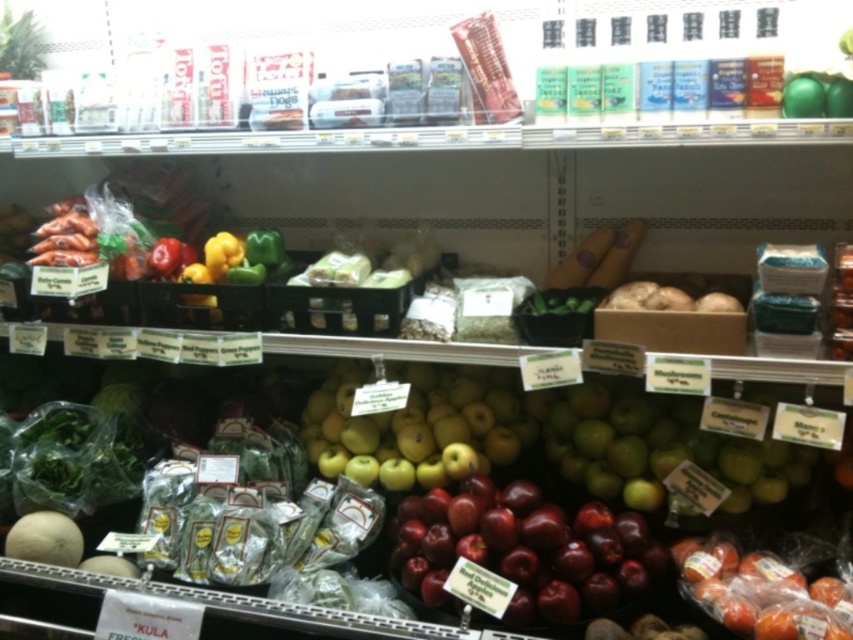
You are a customer in the grocery store looking at the apples on the second shelf. There are yellow matte apples at center and green matte apples at center. Which one is positioned to the left?

The yellow matte apples at center are positioned to the left of the green matte apples at center.

In the scene shown: You are a grocery store employee who needs to restock apples. You have a ladder that can reach up to 1.5 meters. The shiny red apples at lower right are currently placed at a height of 1.2 meters. Can you safely place the green glossy apple at upper right on the shelf without needing the ladder?

The shiny red apples at lower right has a greater height compared to green glossy apple at upper right. Since the shiny red apples are already at 1.2 meters, which is below the ladder limit of 1.5 meters, you can safely place the green glossy apple at upper right without needing the ladder as it is shorter and can be reached easily.